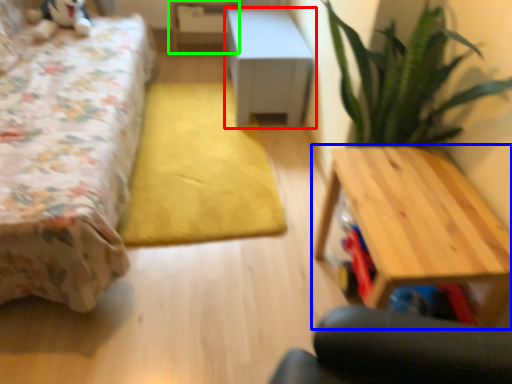
Question: Which is nearer to the table (highlighted by a red box)? table (highlighted by a blue box) or table (highlighted by a green box).

Choices:
 (A) table
 (B) table

Answer: (B)